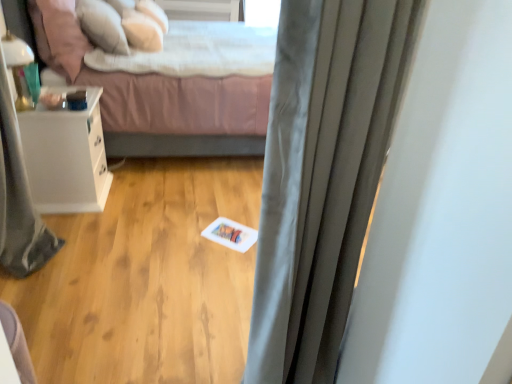
Image resolution: width=512 pixels, height=384 pixels. In order to click on free point in front of gray fabric shower curtain at left in this screenshot , I will do `click(32, 293)`.